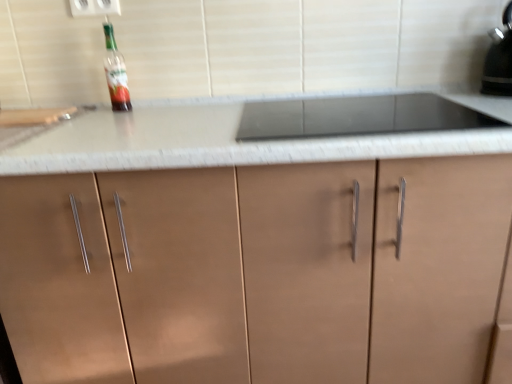
The width and height of the screenshot is (512, 384). I want to click on vacant area to the left of translucent glass bottle at upper left, so click(90, 111).